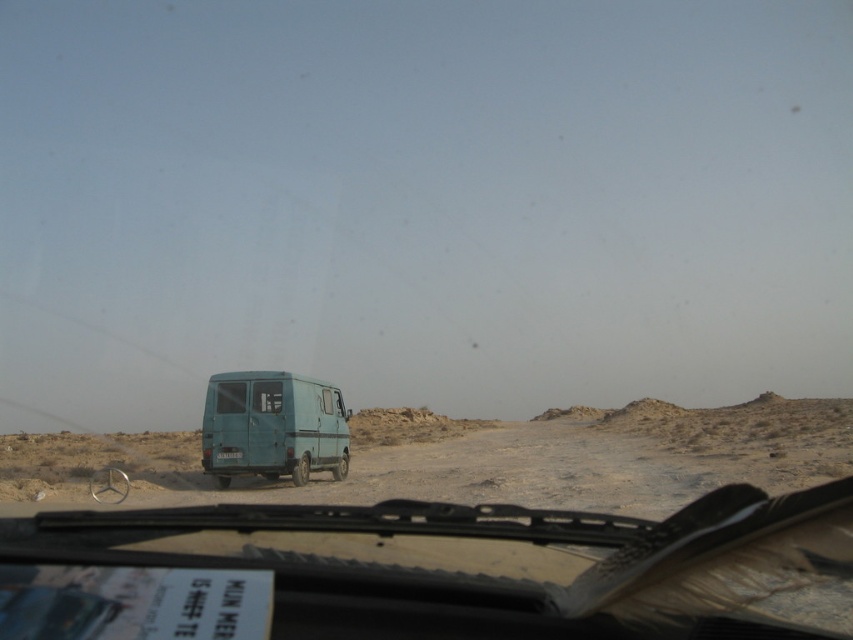
You are driving a car with a 100 meters braking distance at 60 km per hour. You see a blue matte van at center and a teal matte van at center ahead on the road. Can you safely stop before hitting either van if you brake immediately?

The distance between blue matte van at center and teal matte van at center is 27.63 meters. Since your braking distance is 100 meters, you can safely stop before hitting either van if you brake immediately.

You are sitting in the driver seat of the vehicle shown in the image. You notice two points marked on the windshield. The first point is at coordinate point (804, 449) and the second is at point (288, 444). Which point is closer to your eyes?

Point (804, 449) is closer to your eyes because it is further to the viewer than point (288, 444).

You are driving and see both the blue matte van at center and the teal matte van at center through your windshield. Which van is closer to you?

The blue matte van at center is closer to you because it is positioned below the teal matte van at center, indicating it is in a lower, nearer position in the visual field.